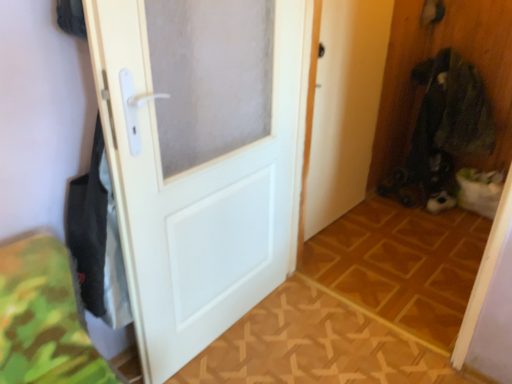
What do you see at coordinates (317, 345) in the screenshot?
I see `wooden parquet floor at center, which is counted as the first tile, starting from the front` at bounding box center [317, 345].

Describe the element at coordinates (401, 264) in the screenshot. The width and height of the screenshot is (512, 384). I see `wooden floor at center, which ranks as the second tile in front-to-back order` at that location.

Measure the distance between point (202,54) and camera.

Point (202,54) is 1.34 meters from camera.

Where is `dark green fabric at right`? Image resolution: width=512 pixels, height=384 pixels. dark green fabric at right is located at coordinates (443, 128).

From the picture: Could wooden parquet floor at center, which is counted as the first tile, starting from the front, be considered to be inside dark green fabric at right?

No.

Which object is thinner, dark green fabric at right or wooden parquet floor at center, which is counted as the first tile, starting from the front?

Thinner between the two is dark green fabric at right.

Considering the relative sizes of dark green fabric at right and wooden parquet floor at center, which is counted as the first tile, starting from the front, in the image provided, is dark green fabric at right smaller than wooden parquet floor at center, which is counted as the first tile, starting from the front,?

No.

Is point (428, 155) behind point (454, 369)?

Yes, point (428, 155) is farther from viewer.

Is white matte door at center not close to wooden parquet floor at center, the 2th tile in the back-to-front sequence?

white matte door at center is near wooden parquet floor at center, the 2th tile in the back-to-front sequence, not far away.

From the picture: From the image's perspective, which one is positioned lower, white matte door at center or wooden parquet floor at center, the 2th tile in the back-to-front sequence?

wooden parquet floor at center, the 2th tile in the back-to-front sequence, is shown below in the image.

Is wooden parquet floor at center, the 2th tile in the back-to-front sequence, shorter than dark green fabric at right?

Yes, wooden parquet floor at center, the 2th tile in the back-to-front sequence, is shorter than dark green fabric at right.

Considering the relative positions of wooden parquet floor at center, which is counted as the first tile, starting from the front, and dark green fabric at right in the image provided, is wooden parquet floor at center, which is counted as the first tile, starting from the front, to the left or to the right of dark green fabric at right?

Based on their positions, wooden parquet floor at center, which is counted as the first tile, starting from the front, is located to the left of dark green fabric at right.

Considering the relative sizes of wooden parquet floor at center, the 2th tile in the back-to-front sequence, and dark green fabric at right in the image provided, is wooden parquet floor at center, the 2th tile in the back-to-front sequence, bigger than dark green fabric at right?

Incorrect, wooden parquet floor at center, the 2th tile in the back-to-front sequence, is not larger than dark green fabric at right.

Is wooden parquet floor at center, which is counted as the first tile, starting from the front, positioned in front of dark green fabric at right?

Yes, wooden parquet floor at center, which is counted as the first tile, starting from the front, is in front of dark green fabric at right.

From a real-world perspective, which is physically above, white matte door at center or dark green fabric at right?

white matte door at center is physically above.

In the scene shown: Is white matte door at center thinner than dark green fabric at right?

Indeed, white matte door at center has a lesser width compared to dark green fabric at right.

Would you say white matte door at center is to the left or to the right of dark green fabric at right in the picture?

In the image, white matte door at center appears on the left side of dark green fabric at right.

The height and width of the screenshot is (384, 512). Identify the location of tile positioned vertically above the wooden parquet floor at center, which is counted as the first tile, starting from the front (from a real-world perspective). (401, 264).

Is wooden parquet floor at center, the 2th tile in the back-to-front sequence, at the back of wooden floor at center, which appears as the first tile when viewed from the back?

No, wooden floor at center, which appears as the first tile when viewed from the back, is not facing the opposite direction of wooden parquet floor at center, the 2th tile in the back-to-front sequence.

Which point is more distant from viewer, (x=384, y=243) or (x=282, y=370)?

The point (x=384, y=243) is farther.

Considering the sizes of objects dark green fabric at right and wooden floor at center, which ranks as the second tile in front-to-back order, in the image provided, who is wider, dark green fabric at right or wooden floor at center, which ranks as the second tile in front-to-back order,?

Wider between the two is wooden floor at center, which ranks as the second tile in front-to-back order.

From the image's perspective, which is above, dark green fabric at right or wooden floor at center, which ranks as the second tile in front-to-back order?

dark green fabric at right, from the image's perspective.

Is dark green fabric at right looking in the opposite direction of wooden floor at center, which appears as the first tile when viewed from the back?

That's not correct — dark green fabric at right is not looking away from wooden floor at center, which appears as the first tile when viewed from the back.

Considering the sizes of objects dark green fabric at right and wooden floor at center, which ranks as the second tile in front-to-back order, in the image provided, who is smaller, dark green fabric at right or wooden floor at center, which ranks as the second tile in front-to-back order,?

With smaller size is wooden floor at center, which ranks as the second tile in front-to-back order.

From the dark green fabric at right, count 1st tiles forward and point to it. Please provide its 2D coordinates.

[(401, 264)]

Can dark green fabric at right be found inside wooden floor at center, which ranks as the second tile in front-to-back order?

Definitely not — dark green fabric at right is not inside wooden floor at center, which ranks as the second tile in front-to-back order.

Which is more to the left, wooden floor at center, which appears as the first tile when viewed from the back, or dark green fabric at right?

wooden floor at center, which appears as the first tile when viewed from the back, is more to the left.

Can you confirm if wooden floor at center, which appears as the first tile when viewed from the back, is smaller than dark green fabric at right?

Yes.

Identify the location of laundry lying behind the wooden parquet floor at center, which is counted as the first tile, starting from the front. The image size is (512, 384). (443, 128).

Find the location of `door on the left of wooden parquet floor at center, the 2th tile in the back-to-front sequence`. door on the left of wooden parquet floor at center, the 2th tile in the back-to-front sequence is located at coordinates [198, 159].

In the scene shown: Considering their positions, is dark green fabric at right positioned closer to white matte door at center than wooden parquet floor at center, the 2th tile in the back-to-front sequence?

wooden parquet floor at center, the 2th tile in the back-to-front sequence, is positioned closer to the anchor white matte door at center.

Estimate the real-world distances between objects in this image. Which object is closer to dark green fabric at right, wooden parquet floor at center, the 2th tile in the back-to-front sequence, or wooden floor at center, which appears as the first tile when viewed from the back?

wooden floor at center, which appears as the first tile when viewed from the back, is positioned closer to the anchor dark green fabric at right.

From the image, which object appears to be nearer to wooden floor at center, which ranks as the second tile in front-to-back order, dark green fabric at right or wooden parquet floor at center, the 2th tile in the back-to-front sequence?

wooden parquet floor at center, the 2th tile in the back-to-front sequence, lies closer to wooden floor at center, which ranks as the second tile in front-to-back order, than the other object.

Considering their positions, is wooden floor at center, which ranks as the second tile in front-to-back order, positioned closer to wooden parquet floor at center, the 2th tile in the back-to-front sequence, than white matte door at center?

wooden floor at center, which ranks as the second tile in front-to-back order, lies closer to wooden parquet floor at center, the 2th tile in the back-to-front sequence, than the other object.

Considering their positions, is wooden floor at center, which ranks as the second tile in front-to-back order, positioned further to wooden parquet floor at center, the 2th tile in the back-to-front sequence, than dark green fabric at right?

Among the two, dark green fabric at right is located further to wooden parquet floor at center, the 2th tile in the back-to-front sequence.

Considering their positions, is wooden parquet floor at center, the 2th tile in the back-to-front sequence, positioned closer to wooden floor at center, which ranks as the second tile in front-to-back order, than dark green fabric at right?

Based on the image, wooden parquet floor at center, the 2th tile in the back-to-front sequence, appears to be nearer to wooden floor at center, which ranks as the second tile in front-to-back order.

Estimate the real-world distances between objects in this image. Which object is further from white matte door at center, dark green fabric at right or wooden floor at center, which ranks as the second tile in front-to-back order?

Among the two, dark green fabric at right is located further to white matte door at center.

Looking at the image, which one is located further to wooden floor at center, which appears as the first tile when viewed from the back, dark green fabric at right or white matte door at center?

white matte door at center is further to wooden floor at center, which appears as the first tile when viewed from the back.

In order to click on tile between white matte door at center and wooden floor at center, which appears as the first tile when viewed from the back in this screenshot , I will do tap(317, 345).

Locate an element on the screen. This screenshot has height=384, width=512. tile located between wooden parquet floor at center, which is counted as the first tile, starting from the front, and dark green fabric at right in the depth direction is located at coordinates (401, 264).